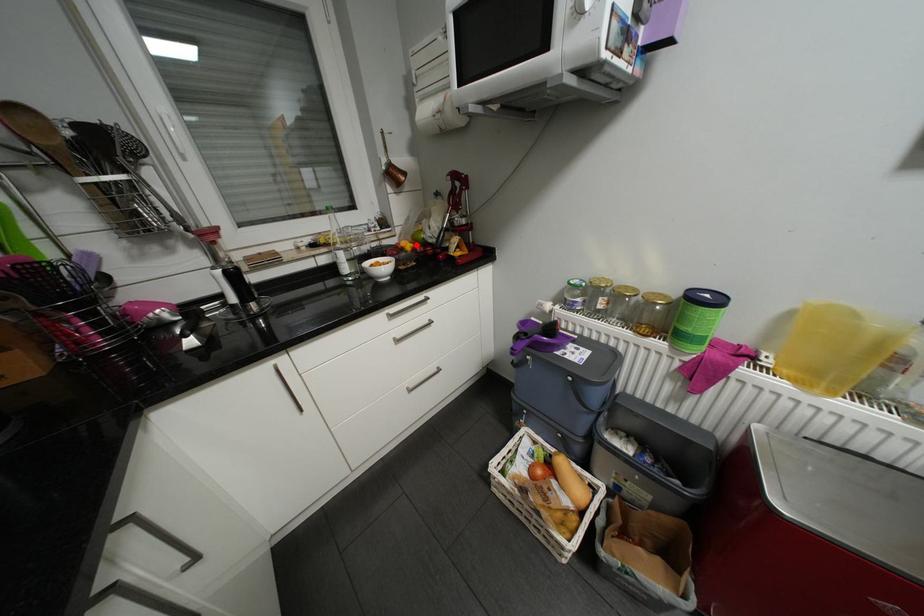
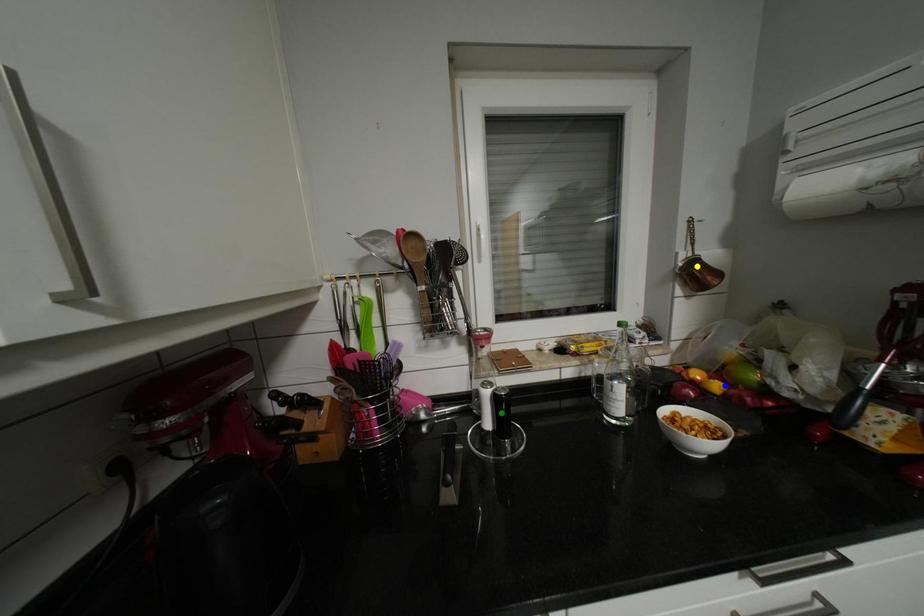
Question: I am providing you with two images of the same scene from different viewpoints. A red point is marked on the first image. You are given multiple points on the second image. Which spot in image 2 lines up with the point in image 1?

Choices:
 (A) yellow point
 (B) blue point
 (C) green point

Answer: (B)